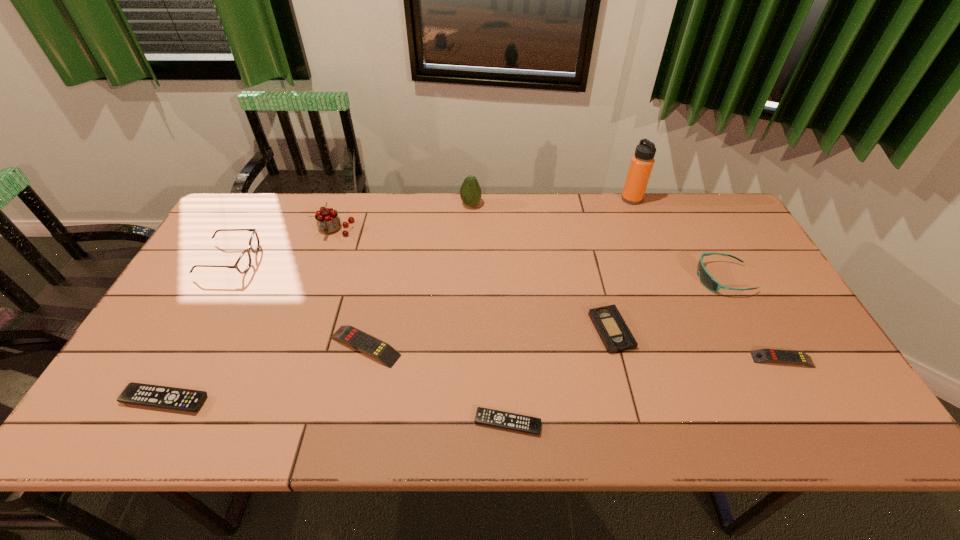
Locate an element on the screen. Image resolution: width=960 pixels, height=540 pixels. free space at the far left corner of the desktop is located at coordinates (282, 202).

Locate an element on the screen. vacant space at the near right corner of the desktop is located at coordinates click(800, 428).

This screenshot has width=960, height=540. Identify the location of vacant space that is in between the sixth tallest object and the right yellow remote control. (574, 353).

Where is `vacant space that is in between the bigger black remote control and the avocado`? vacant space that is in between the bigger black remote control and the avocado is located at coordinates (318, 302).

Locate an element on the screen. This screenshot has height=540, width=960. free space between the avocado and the third remote control from left to right is located at coordinates [x=490, y=314].

Where is `free point between the spectacles and the sunglasses`? The image size is (960, 540). free point between the spectacles and the sunglasses is located at coordinates (476, 269).

Locate an element on the screen. The width and height of the screenshot is (960, 540). free space between the right black remote control and the avocado is located at coordinates (490, 314).

Locate an element on the screen. This screenshot has width=960, height=540. unoccupied position between the fourth object from right to left and the tallest object is located at coordinates (621, 265).

Identify the location of vacant area between the tallest remote control and the spectacles. Image resolution: width=960 pixels, height=540 pixels. (298, 303).

Find the location of a particular element. This screenshot has height=540, width=960. vacant area between the third object from right to left and the third remote control from left to right is located at coordinates pyautogui.click(x=569, y=310).